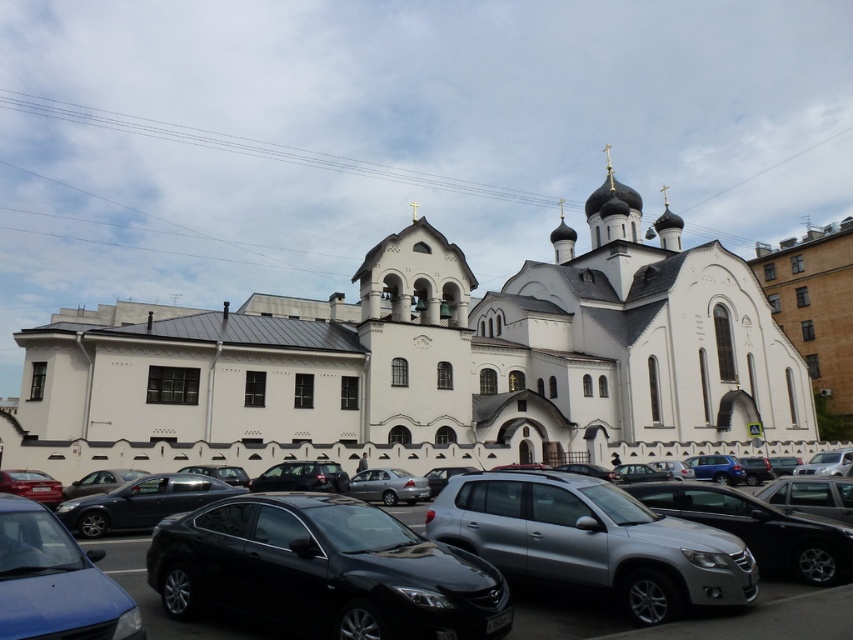
The height and width of the screenshot is (640, 853). What do you see at coordinates (592, 540) in the screenshot?
I see `silver metallic suv at center` at bounding box center [592, 540].

Does silver metallic suv at center appear over satin silver sedan at center?

Correct, silver metallic suv at center is located above satin silver sedan at center.

Image resolution: width=853 pixels, height=640 pixels. I want to click on silver metallic suv at center, so click(592, 540).

Does white stone church at center have a greater width compared to satin black sedan at lower left?

Correct, the width of white stone church at center exceeds that of satin black sedan at lower left.

Locate an element on the screen. The height and width of the screenshot is (640, 853). white stone church at center is located at coordinates (432, 362).

Is point (693, 248) more distant than point (73, 502)?

Yes, it is.

In order to click on white stone church at center in this screenshot , I will do `click(432, 362)`.

Which is more to the left, black metallic cars at lower center or satin black sedan at lower left?

satin black sedan at lower left

Is black metallic cars at lower center in front of satin black sedan at lower left?

Yes, it is in front of satin black sedan at lower left.

The image size is (853, 640). What do you see at coordinates (775, 612) in the screenshot? I see `black metallic cars at lower center` at bounding box center [775, 612].

At what (x,y) coordinates should I click in order to perform the action: click on black metallic cars at lower center. Please return your answer as a coordinate pair (x, y). Image resolution: width=853 pixels, height=640 pixels. Looking at the image, I should click on (775, 612).